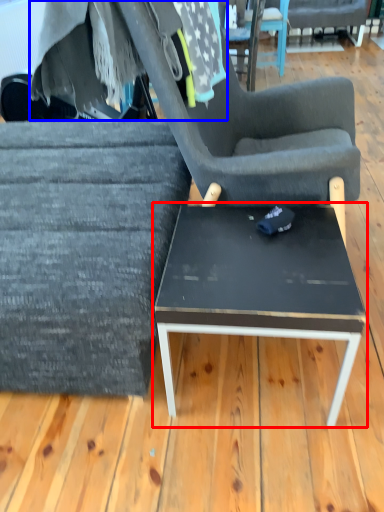
Question: Which object is further to the camera taking this photo, coffee table (highlighted by a red box) or fabric (highlighted by a blue box)?

Choices:
 (A) coffee table
 (B) fabric

Answer: (B)